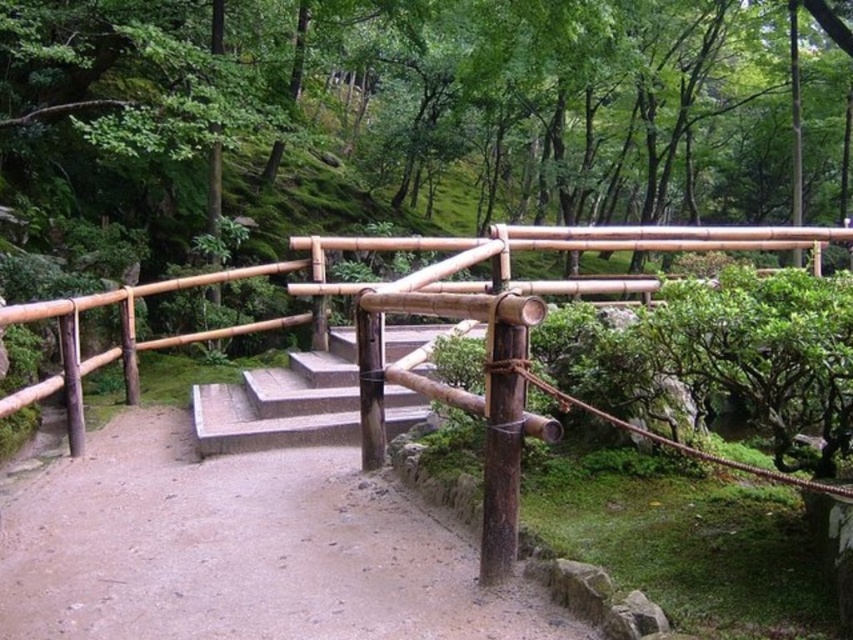
Question: Is natural bamboo railing at center positioned behind smooth concrete stairs at center?

Choices:
 (A) yes
 (B) no

Answer: (B)

Question: Based on their relative distances, which object is farther from the smooth concrete stairs at center?

Choices:
 (A) natural bamboo railing at center
 (B) brown gravel path at center

Answer: (A)

Question: Does brown gravel path at center appear on the left side of natural bamboo railing at center?

Choices:
 (A) no
 (B) yes

Answer: (B)

Question: Among these objects, which one is nearest to the camera?

Choices:
 (A) natural bamboo railing at center
 (B) brown gravel path at center
 (C) smooth concrete stairs at center

Answer: (B)

Question: Which point is farther from the camera taking this photo?

Choices:
 (A) (364, 525)
 (B) (281, 372)
 (C) (462, 268)

Answer: (B)

Question: Considering the relative positions of brown gravel path at center and natural bamboo railing at center in the image provided, where is brown gravel path at center located with respect to natural bamboo railing at center?

Choices:
 (A) right
 (B) left

Answer: (B)